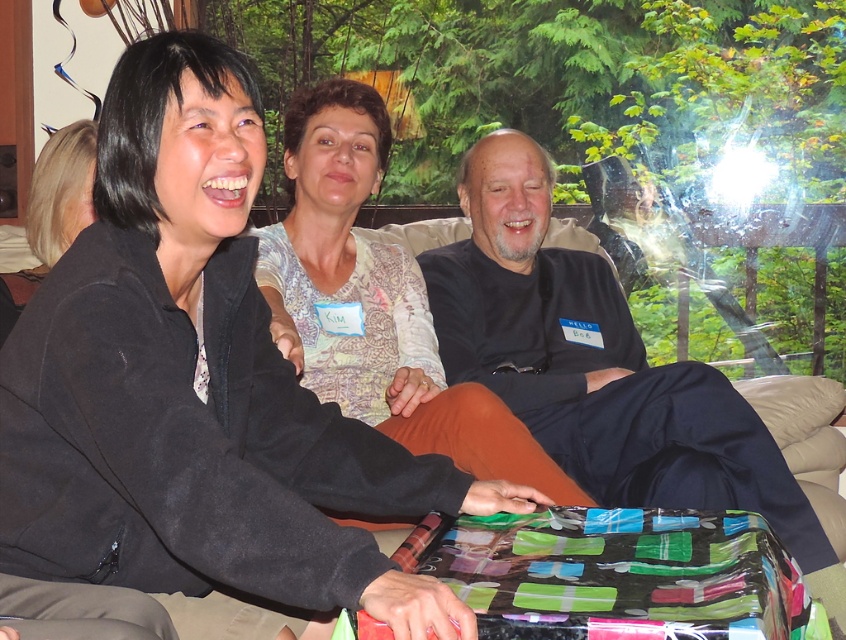
Question: Considering the relative positions of black matte shirt at center and patterned fabric shirt at center in the image provided, where is black matte shirt at center located with respect to patterned fabric shirt at center?

Choices:
 (A) below
 (B) above

Answer: (A)

Question: Which of the following is the farthest from the observer?

Choices:
 (A) black matte shirt at center
 (B) patterned fabric shirt at center

Answer: (A)

Question: Which object is closer to the camera taking this photo?

Choices:
 (A) black matte shirt at center
 (B) patterned fabric shirt at center

Answer: (B)

Question: Which point is closer to the camera?

Choices:
 (A) black matte shirt at center
 (B) patterned fabric shirt at center

Answer: (B)

Question: Considering the relative positions of black matte shirt at center and patterned fabric shirt at center in the image provided, where is black matte shirt at center located with respect to patterned fabric shirt at center?

Choices:
 (A) right
 (B) left

Answer: (A)

Question: Where is black matte shirt at center located in relation to patterned fabric shirt at center in the image?

Choices:
 (A) right
 (B) left

Answer: (A)